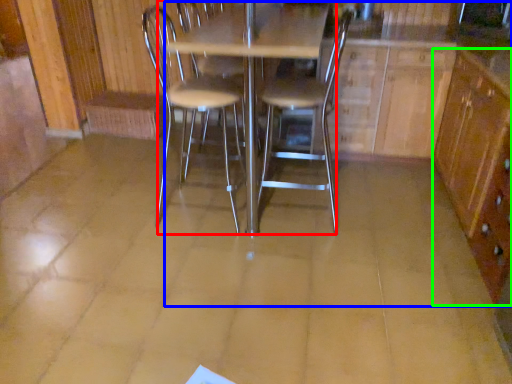
Question: Considering the real-world distances, which object is closest to table (highlighted by a red box)? dresser (highlighted by a blue box) or file cabinet (highlighted by a green box).

Choices:
 (A) dresser
 (B) file cabinet

Answer: (A)